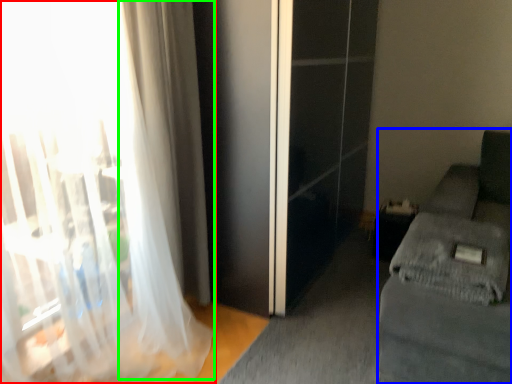
Question: Estimate the real-world distances between objects in this image. Which object is farther from curtain (highlighted by a red box), studio couch (highlighted by a blue box) or curtain (highlighted by a green box)?

Choices:
 (A) studio couch
 (B) curtain

Answer: (A)